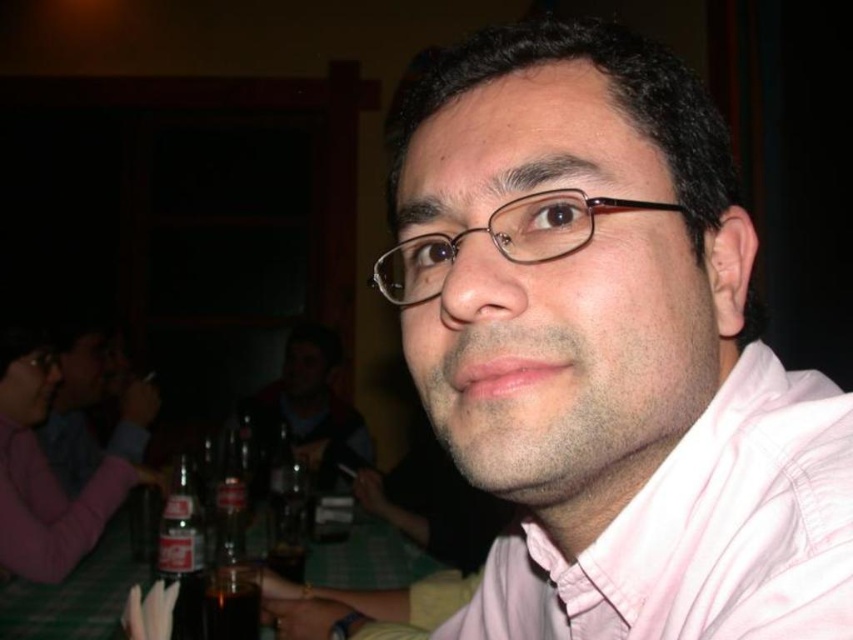
Question: Is pink fabric shirt at center to the right of pink cotton dress shirt at center from the viewer's perspective?

Choices:
 (A) no
 (B) yes

Answer: (A)

Question: Can you confirm if pink cotton dress shirt at center is positioned to the left of matte glass bottle at lower left?

Choices:
 (A) no
 (B) yes

Answer: (A)

Question: Observing the image, what is the correct spatial positioning of pink fabric shirt at center in reference to brown glass bottle at center?

Choices:
 (A) below
 (B) above

Answer: (B)

Question: Which object is the farthest from the matte black shirt at center?

Choices:
 (A) pink cotton dress shirt at center
 (B) pink fabric shirt at center
 (C) matte glass bottle at lower left

Answer: (A)

Question: Which is nearer to the brown glass bottle at center?

Choices:
 (A) pink cotton dress shirt at center
 (B) matte black shirt at center
 (C) green fabric table at lower left

Answer: (C)

Question: Which object is the farthest from the matte black shirt at center?

Choices:
 (A) pink cotton dress shirt at center
 (B) pink fabric shirt at center
 (C) matte glass bottle at lower left

Answer: (A)